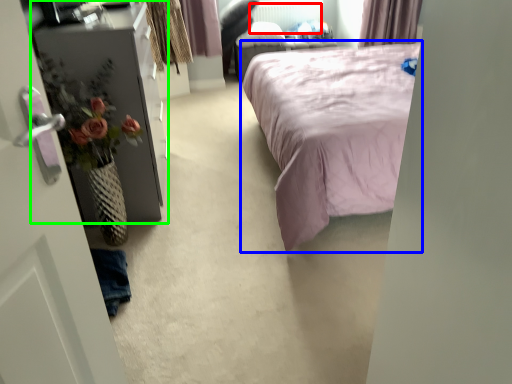
Question: Considering the real-world distances, which object is closest to radiator (highlighted by a red box)? bed (highlighted by a blue box) or furniture (highlighted by a green box).

Choices:
 (A) bed
 (B) furniture

Answer: (A)